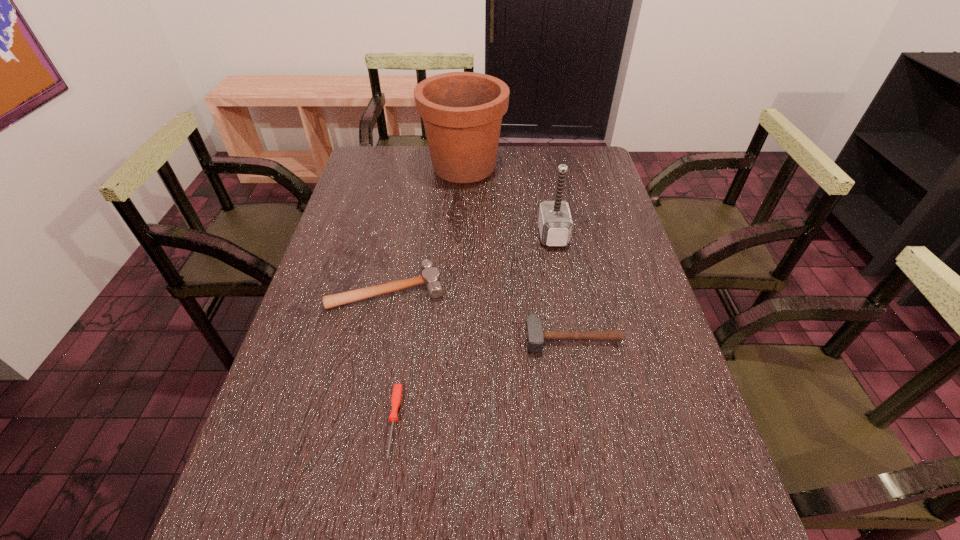
Where is `vacant space at the left edge of the desktop`? The height and width of the screenshot is (540, 960). vacant space at the left edge of the desktop is located at coordinates (336, 284).

In the image, there is a desktop. At what (x,y) coordinates should I click in order to perform the action: click on vacant space at the right edge. Please return your answer as a coordinate pair (x, y). Looking at the image, I should click on coord(612,284).

Find the location of a particular element. free space between the nearest object and the leftmost hammer is located at coordinates (391, 355).

Where is `vacant space that is in between the screwdriver and the nearest hammer`? This screenshot has width=960, height=540. vacant space that is in between the screwdriver and the nearest hammer is located at coordinates (483, 380).

Identify the location of unoccupied position between the shortest object and the nearest hammer. (483, 380).

I want to click on vacant point located between the farthest object and the shortest object, so click(x=429, y=294).

The width and height of the screenshot is (960, 540). Identify the location of empty space that is in between the fourth farthest object and the fourth shortest object. (563, 286).

The height and width of the screenshot is (540, 960). What are the coordinates of `vacant region between the second farthest hammer and the screwdriver` in the screenshot? It's located at (391, 355).

Locate an element on the screen. This screenshot has height=540, width=960. empty space that is in between the leftmost hammer and the second nearest object is located at coordinates (479, 313).

Locate an element on the screen. This screenshot has height=540, width=960. free space between the shortest object and the flowerpot is located at coordinates (429, 294).